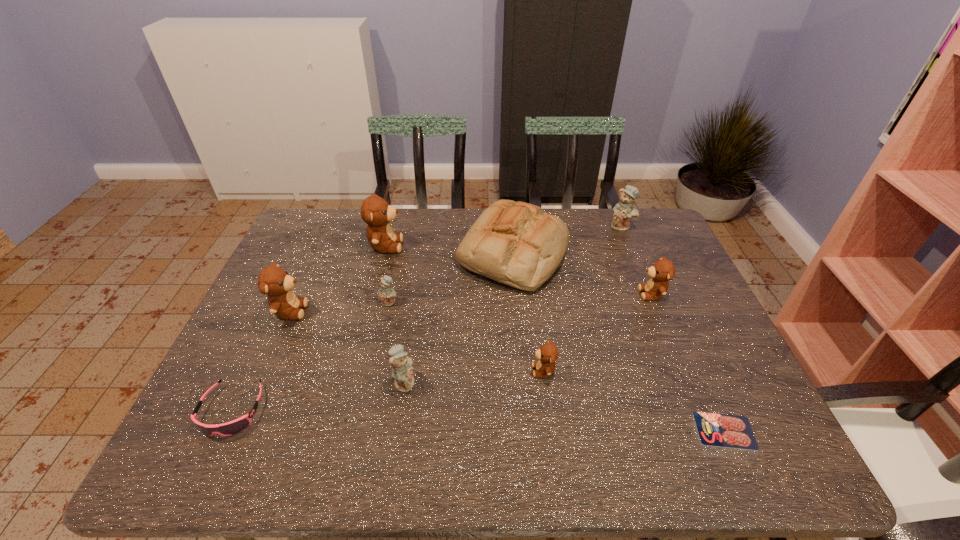
You are a GUI agent. You are given a task and a screenshot of the screen. Output one action in this format:
    pyautogui.click(x=<x>, y=<y>)
    Task: Click on the bread positioned at the far edge
    The width and height of the screenshot is (960, 540).
    Given the screenshot: What is the action you would take?
    pyautogui.click(x=517, y=244)

Where is `goggles situated at the near edge`? This screenshot has width=960, height=540. goggles situated at the near edge is located at coordinates (237, 425).

Locate an element on the screen. The height and width of the screenshot is (540, 960). salami located at the near edge is located at coordinates (721, 430).

Where is `teddy bear positioned at the left edge`? The image size is (960, 540). teddy bear positioned at the left edge is located at coordinates (274, 281).

The height and width of the screenshot is (540, 960). Identify the location of goggles at the left edge. (237, 425).

This screenshot has width=960, height=540. I want to click on salami at the right edge, so tap(721, 430).

Find the location of a particular element. The height and width of the screenshot is (540, 960). object located in the near left corner section of the desktop is located at coordinates (237, 425).

Where is `object that is at the far right corner`? object that is at the far right corner is located at coordinates (623, 211).

At what (x,y) coordinates should I click in order to perform the action: click on object at the near right corner. Please return your answer as a coordinate pair (x, y). Looking at the image, I should click on (721, 430).

Identify the location of free space at the far edge. click(x=404, y=212).